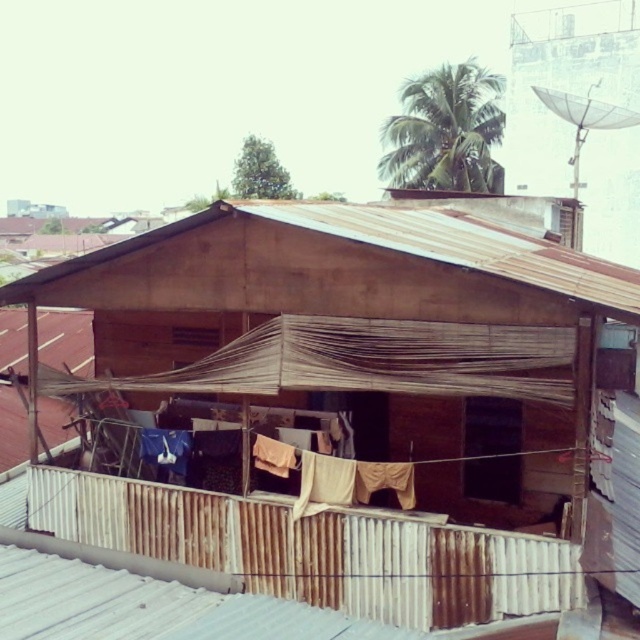
Based on the scene description, which object is taller between the brown corrugated metal hut at center and the brown corrugated metal roof at center?

The brown corrugated metal hut at center is taller than the brown corrugated metal roof at center.

You are standing at the point with coordinates (348, 408) in the image. What object is located exactly at this point?

The brown corrugated metal hut at center is located exactly at point (348, 408).

You are standing on the rooftop and want to take a photo of the brown corrugated metal hut at center. If your camera has a maximum focus range of 10 meters, will it be able to capture the hut clearly?

The brown corrugated metal hut at center is 9.30 meters away from the camera, which is within the maximum focus range of 10 meters. Therefore, the camera should be able to capture the hut clearly.